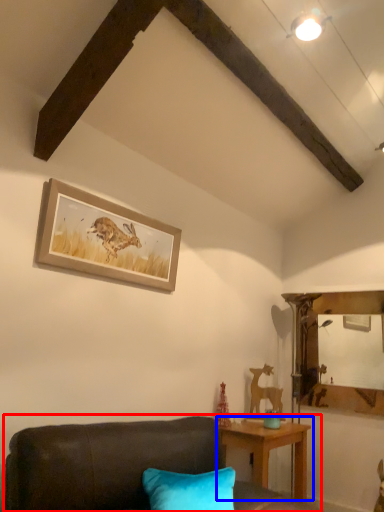
Question: Among these objects, which one is nearest to the camera, studio couch (highlighted by a red box) or table (highlighted by a blue box)?

Choices:
 (A) studio couch
 (B) table

Answer: (A)